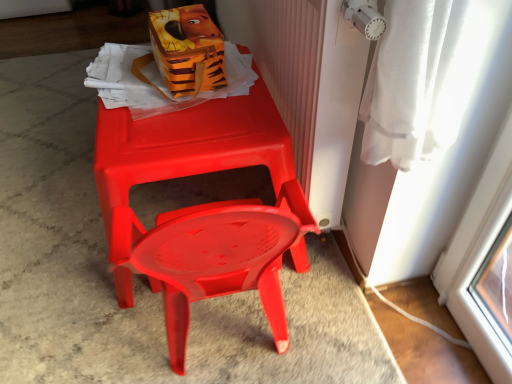
Question: Is point (166, 61) closer or farther from the camera than point (174, 173)?

Choices:
 (A) closer
 (B) farther

Answer: (B)

Question: From a real-world perspective, is orange fabric lunch box at upper center above or below matte plastic chair at center?

Choices:
 (A) below
 (B) above

Answer: (B)

Question: Estimate the real-world distances between objects in this image. Which object is farther from the matte plastic chair at center?

Choices:
 (A) orange fabric lunch box at upper center
 (B) white textured radiator at upper right

Answer: (B)

Question: Which is nearer to the orange fabric lunch box at upper center?

Choices:
 (A) white textured radiator at upper right
 (B) matte plastic chair at center

Answer: (B)